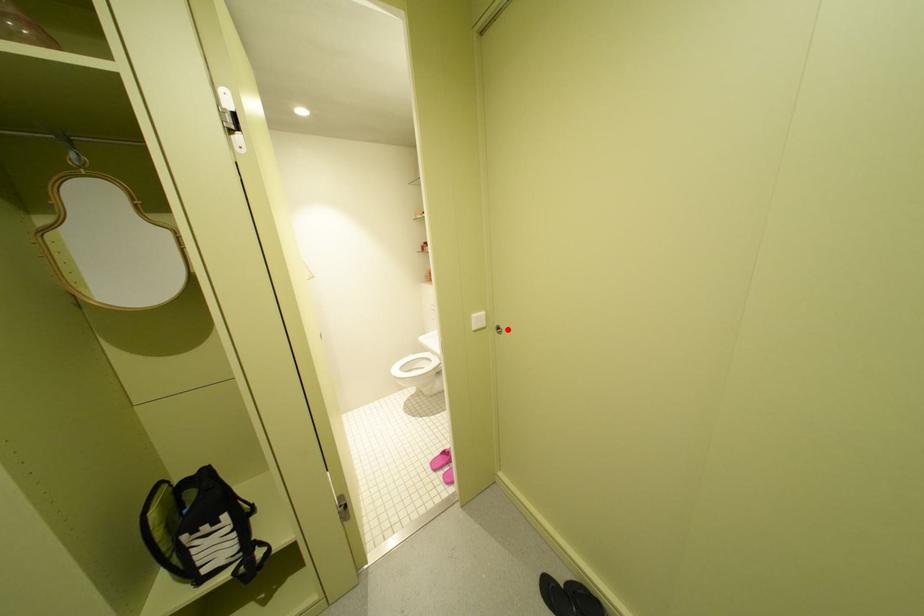
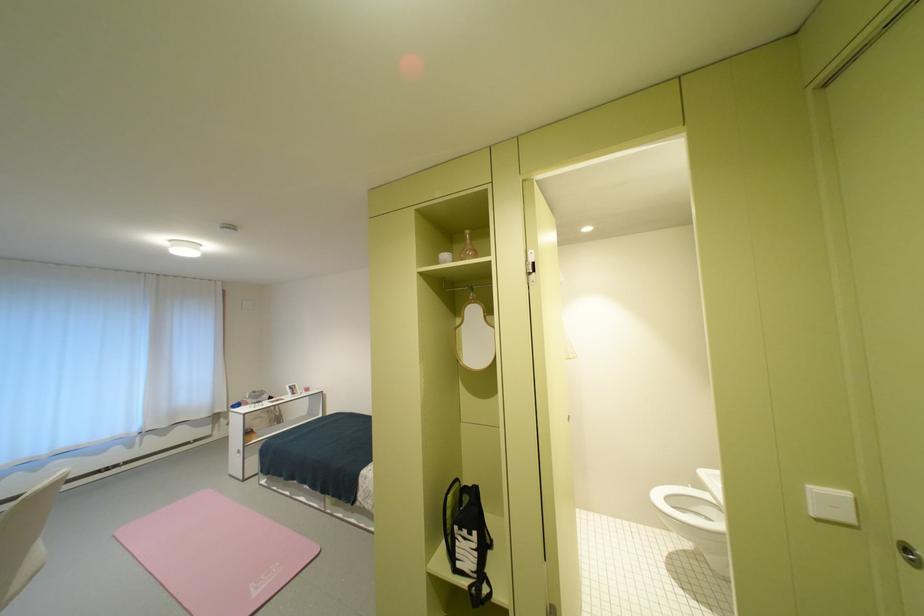
Question: I am providing you with two images of the same scene from different viewpoints. A red point is marked on the first image. Is the red point's position out of view in image 2?

Choices:
 (A) Yes
 (B) No

Answer: (B)